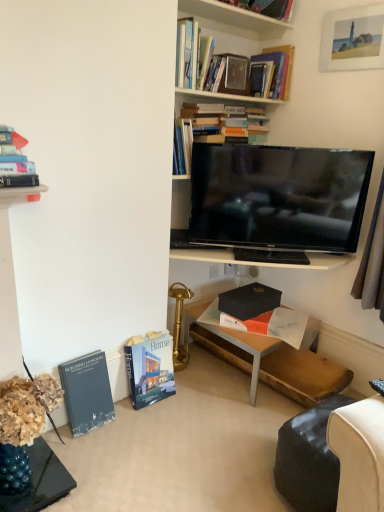
Question: In the image, is black matte box at center, which is counted as the 4th book, starting from the top, on the left side or the right side of black glossy tv at upper center?

Choices:
 (A) right
 (B) left

Answer: (B)

Question: Is point (246, 314) positioned closer to the camera than point (294, 186)?

Choices:
 (A) closer
 (B) farther

Answer: (B)

Question: Based on their relative distances, which object is farther from the hardcover book at lower left, the 6th book viewed from the top?

Choices:
 (A) hardcover book at upper left, which is the 4th book in bottom-to-top order
 (B) leather swivel chair at lower right
 (C) hardcover book at lower left, marked as the 5th book in a top-to-bottom arrangement
 (D) black matte box at center, which appears as the 3th book when ordered from the bottom
 (E) matte black table at center

Answer: (A)

Question: Based on their relative distances, which object is farther from the black glossy tv at upper center?

Choices:
 (A) hardcover book at lower left, marked as the 5th book in a top-to-bottom arrangement
 (B) hardcover book at upper center, the sixth book in the bottom-to-top sequence
 (C) wooden bookshelf at upper center
 (D) hardcover book at lower left, arranged as the first book when ordered from the bottom
 (E) hardcover book at upper left, arranged as the third book when viewed from the top

Answer: (E)